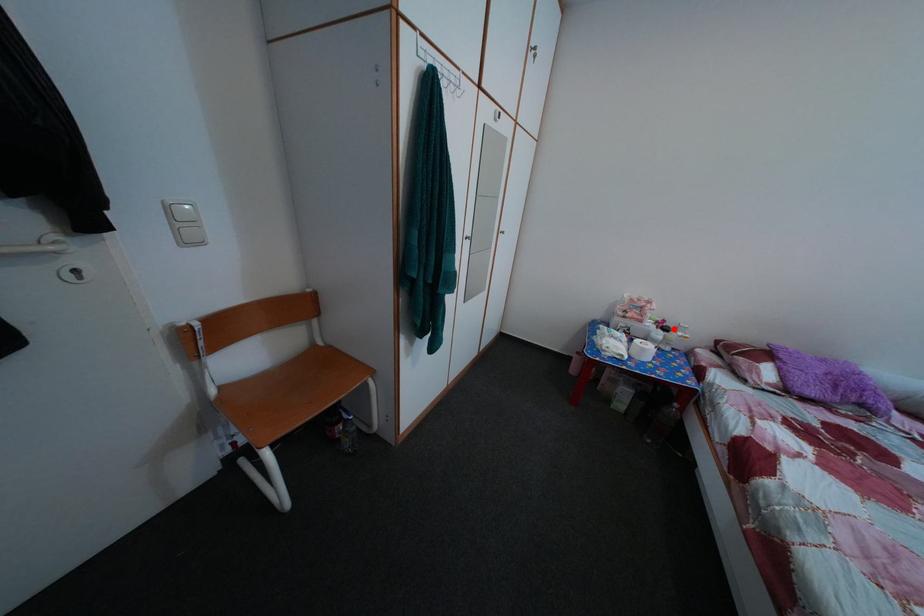
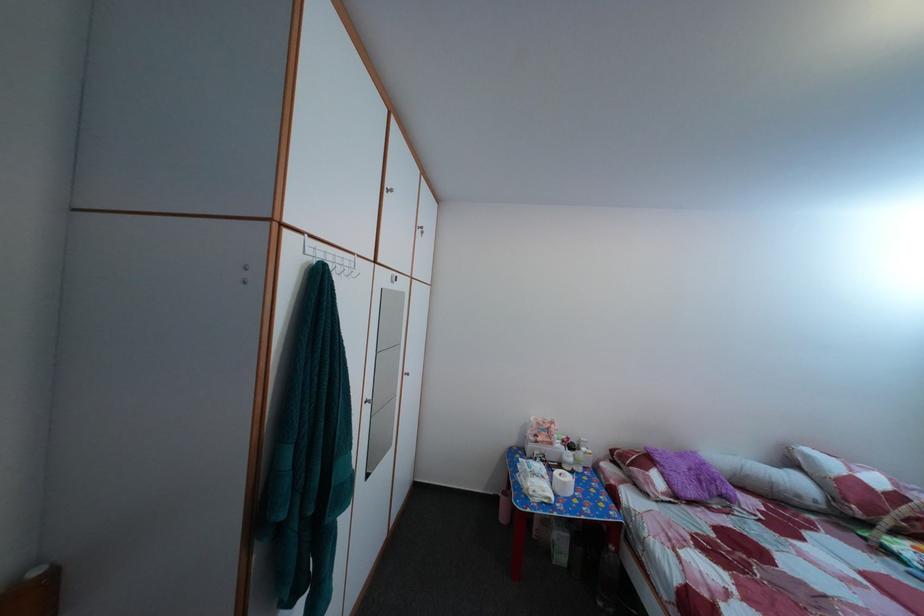
Find the pixel in the second image that matches the highlighted location in the first image.

(578, 447)